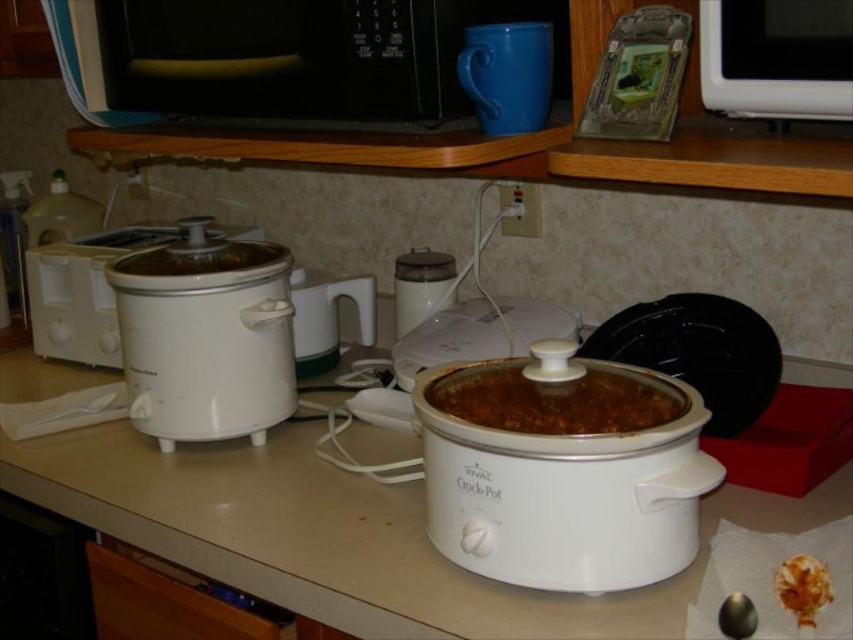
Question: Which point is closer to the camera?

Choices:
 (A) (845, 468)
 (B) (96, 336)

Answer: (A)

Question: Considering the real-world distances, which object is farthest from the white plastic blender at center?

Choices:
 (A) brown matte crock-pot at center
 (B) white matte slow cooker at center

Answer: (B)

Question: Is black plastic microwave at upper center positioned at the back of white matte slow cooker at center?

Choices:
 (A) yes
 (B) no

Answer: (B)

Question: Does brown matte crock-pot at center lie behind brown crumbly food at lower right?

Choices:
 (A) yes
 (B) no

Answer: (A)

Question: Which object appears farthest from the camera in this image?

Choices:
 (A) white matte slow cooker at center
 (B) black plastic microwave at upper center
 (C) white matte crock-pot at center

Answer: (A)

Question: Is white plastic countertop at center to the right of brown matte crock-pot at center from the viewer's perspective?

Choices:
 (A) yes
 (B) no

Answer: (B)